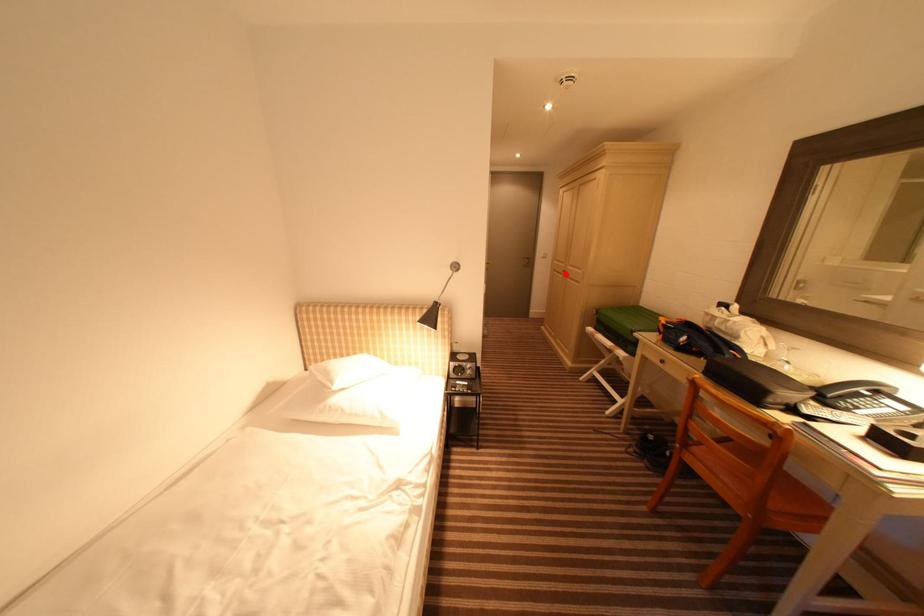
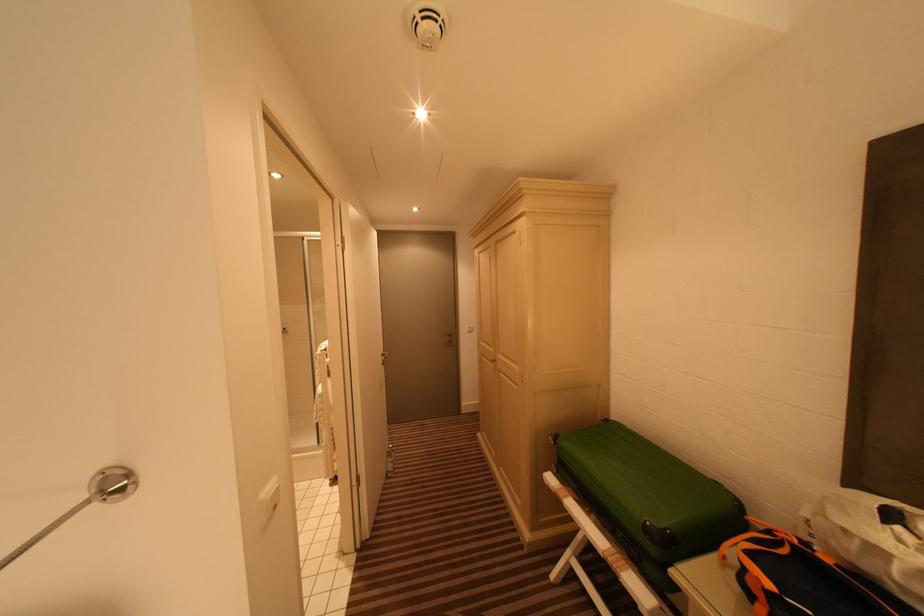
Find the pixel in the second image that matches the highlighted location in the first image.

(494, 362)